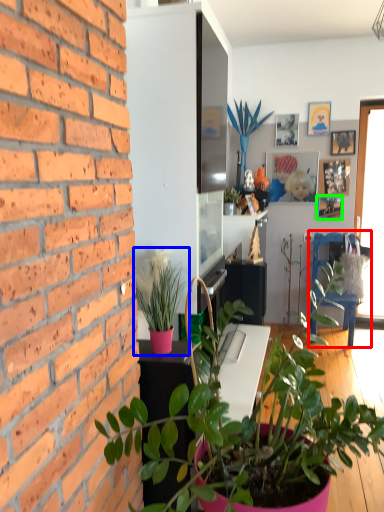
Question: Considering the real-world distances, which object is farthest from armchair (highlighted by a red box)? houseplant (highlighted by a blue box) or picture frame (highlighted by a green box)?

Choices:
 (A) houseplant
 (B) picture frame

Answer: (A)